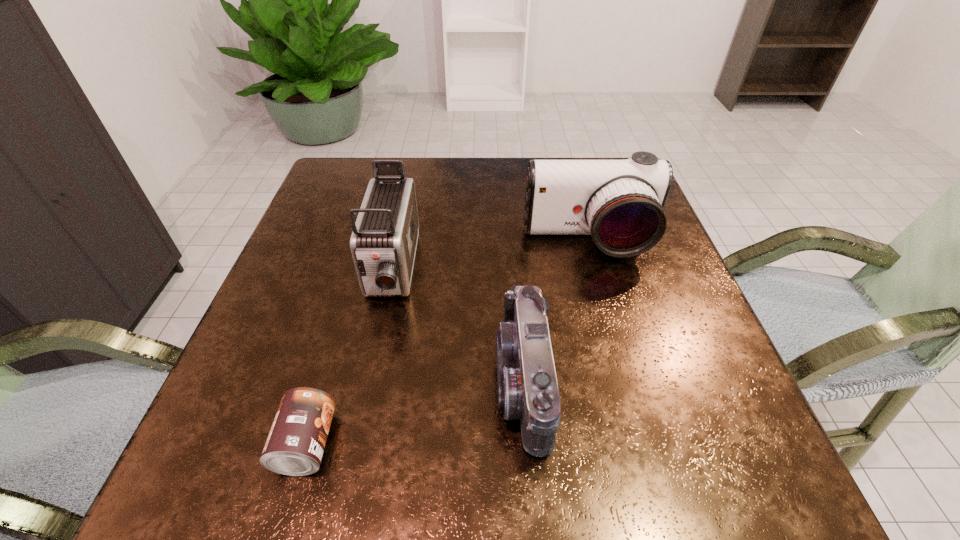
Where is `can situated at the near edge`? The width and height of the screenshot is (960, 540). can situated at the near edge is located at coordinates (295, 445).

Locate an element on the screen. object at the left edge is located at coordinates (295, 445).

The image size is (960, 540). What are the coordinates of `object that is at the right edge` in the screenshot? It's located at (620, 203).

I want to click on object that is at the near left corner, so click(295, 445).

Image resolution: width=960 pixels, height=540 pixels. In the image, there is a desktop. In order to click on vacant space at the far edge in this screenshot , I will do `click(495, 172)`.

Locate an element on the screen. vacant space at the near edge is located at coordinates (471, 503).

Where is `vacant space at the left edge of the desktop`? Image resolution: width=960 pixels, height=540 pixels. vacant space at the left edge of the desktop is located at coordinates (324, 306).

Image resolution: width=960 pixels, height=540 pixels. In the image, there is a desktop. What are the coordinates of `vacant space at the right edge` in the screenshot? It's located at (677, 336).

I want to click on free space at the far left corner of the desktop, so click(x=351, y=184).

At what (x,y) coordinates should I click in order to perform the action: click on free space between the shortest object and the leftmost camcorder. Please return your answer as a coordinate pair (x, y). The width and height of the screenshot is (960, 540). Looking at the image, I should click on pyautogui.click(x=349, y=356).